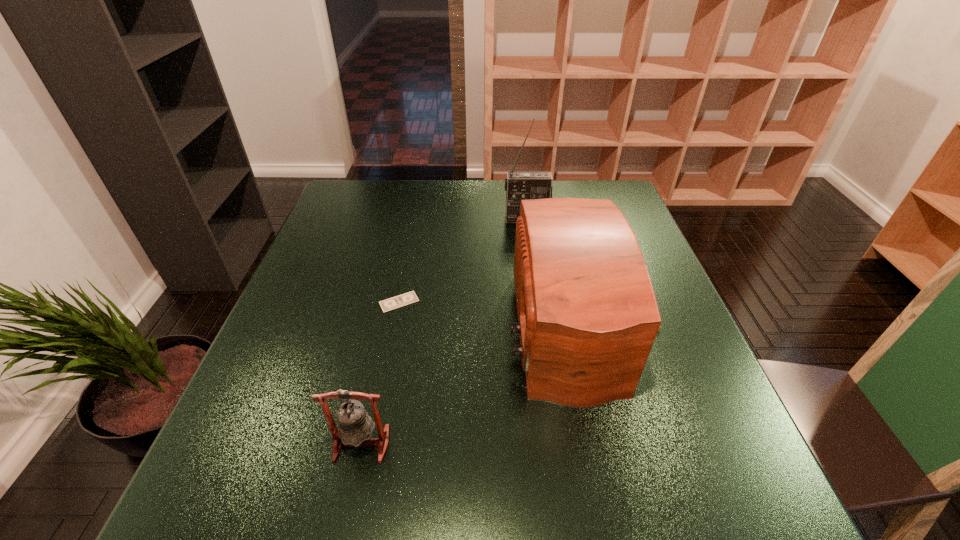
Where is `object that stands as the second closest to the shortest object`? The width and height of the screenshot is (960, 540). object that stands as the second closest to the shortest object is located at coordinates (355, 426).

Identify which object is the second nearest to the nearest object. Please provide its 2D coordinates. Your answer should be formatted as a tuple, i.e. [(x, y)], where the tuple contains the x and y coordinates of a point satisfying the conditions above.

[(408, 298)]

Identify the location of blank area in the image that satisfies the following two spatial constraints: 1. on the back side of the nearest object; 2. on the right side of the money. The width and height of the screenshot is (960, 540). (393, 302).